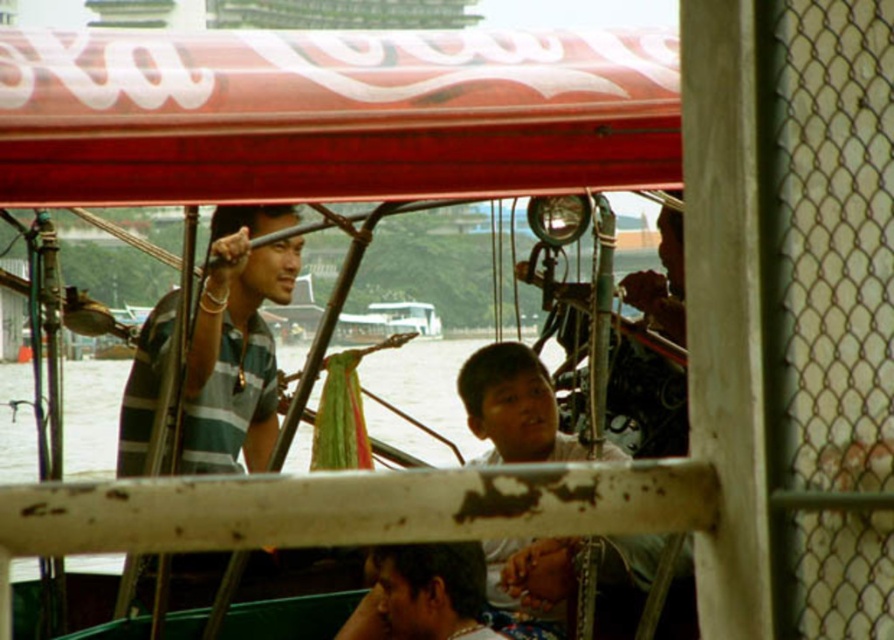
Question: Can you confirm if light brown skin boy at center is positioned below clear water at lower left?

Choices:
 (A) no
 (B) yes

Answer: (B)

Question: Which point is farther to the camera?

Choices:
 (A) (447, 365)
 (B) (410, 552)
 (C) (532, 376)
 (D) (159, 321)

Answer: (A)

Question: Which of the following is the farthest from the observer?

Choices:
 (A) (679, 605)
 (B) (270, 273)

Answer: (B)

Question: Is green striped shirt at center below clear water at lower left?

Choices:
 (A) yes
 (B) no

Answer: (B)

Question: Which object appears closest to the camera in this image?

Choices:
 (A) green striped shirt at center
 (B) light brown skin boy at center
 (C) clear water at lower left

Answer: (C)

Question: Can you confirm if clear water at lower left is positioned above dark brown skin at lower center?

Choices:
 (A) yes
 (B) no

Answer: (A)